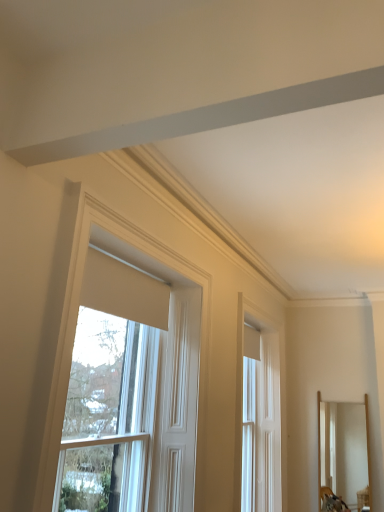
Question: Is wooden mirror at right behind white matte window at upper center, positioned as the first window in front-to-back order?

Choices:
 (A) yes
 (B) no

Answer: (A)

Question: Does wooden mirror at right appear on the left side of white matte window at upper center, placed as the 2th window when sorted from back to front?

Choices:
 (A) yes
 (B) no

Answer: (B)

Question: Is wooden mirror at right positioned before white matte window at upper center, positioned as the first window in front-to-back order?

Choices:
 (A) yes
 (B) no

Answer: (B)

Question: Is wooden mirror at right bigger than white matte window at upper center, arranged as the first window when viewed from the left?

Choices:
 (A) yes
 (B) no

Answer: (B)

Question: Considering the relative sizes of wooden mirror at right and white matte window at upper center, the second window positioned from the right, in the image provided, is wooden mirror at right taller than white matte window at upper center, the second window positioned from the right,?

Choices:
 (A) no
 (B) yes

Answer: (A)

Question: Is wooden mirror at right shorter than white matte window at upper center, placed as the 2th window when sorted from back to front?

Choices:
 (A) no
 (B) yes

Answer: (B)

Question: Is wooden mirror at right in front of white glossy door at center, which ranks as the 2th window in front-to-back order?

Choices:
 (A) no
 (B) yes

Answer: (A)

Question: Is wooden mirror at right outside of white glossy door at center, the 2th window positioned from the left?

Choices:
 (A) no
 (B) yes

Answer: (B)

Question: Considering the relative positions of wooden mirror at right and white glossy door at center, the 2th window positioned from the left, in the image provided, is wooden mirror at right to the left of white glossy door at center, the 2th window positioned from the left, from the viewer's perspective?

Choices:
 (A) no
 (B) yes

Answer: (A)

Question: Is wooden mirror at right turned away from white glossy door at center, which is the 1th window from right to left?

Choices:
 (A) yes
 (B) no

Answer: (B)

Question: Is white glossy door at center, which is the 1th window from right to left, completely or partially inside wooden mirror at right?

Choices:
 (A) no
 (B) yes

Answer: (A)

Question: Does wooden mirror at right appear on the right side of white glossy door at center, which is the 1th window from right to left?

Choices:
 (A) yes
 (B) no

Answer: (A)

Question: Is white matte window at upper center, arranged as the first window when viewed from the left, placed right next to wooden mirror at right?

Choices:
 (A) no
 (B) yes

Answer: (A)